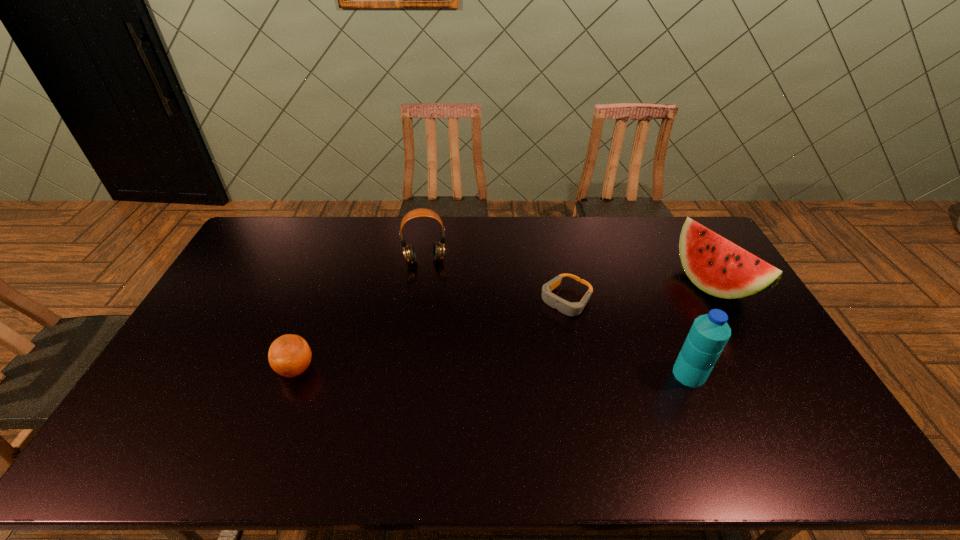
Where is `free space on the desktop that is between the leftmost object and the water bottle and is positioned on the ear cups of the headset`? The image size is (960, 540). free space on the desktop that is between the leftmost object and the water bottle and is positioned on the ear cups of the headset is located at coordinates (436, 371).

Identify the location of free space on the desktop that is between the leftmost object and the second object from right to left and is positioned on the outer rind of the watermelon. This screenshot has height=540, width=960. (540, 372).

Where is `free spot on the desktop that is between the leftmost object and the fourth object from left to right and is positioned on the front and back of the shortest object`? free spot on the desktop that is between the leftmost object and the fourth object from left to right and is positioned on the front and back of the shortest object is located at coordinates (494, 372).